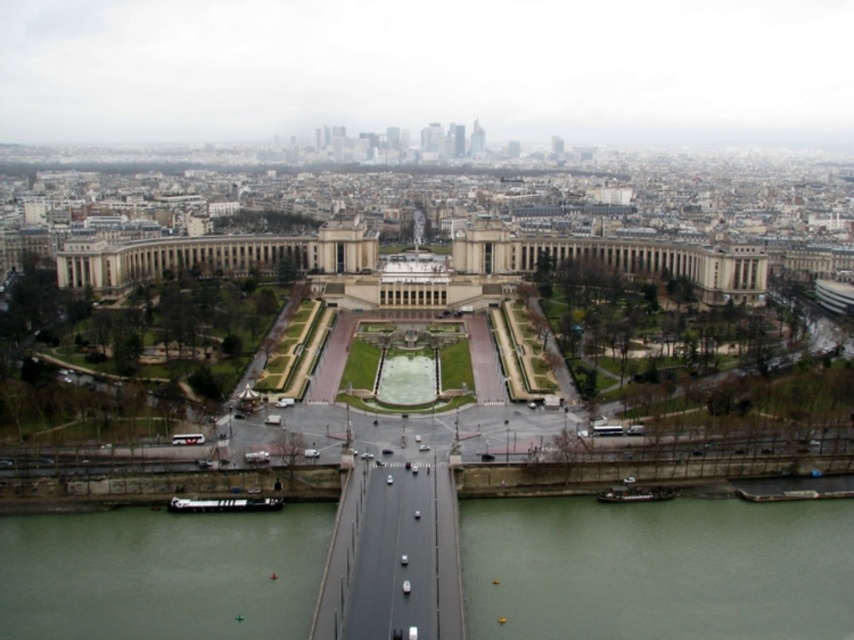
What are the coordinates of `green water at lower right` in the screenshot? It's located at (656, 568).

Between green water at lower right and clear glass waterway at center, which one appears on the left side from the viewer's perspective?

clear glass waterway at center

What are the coordinates of `green water at lower right` in the screenshot? It's located at (656, 568).

Does green water at lower left have a greater width compared to clear glass waterway at center?

Yes, green water at lower left is wider than clear glass waterway at center.

Is point (0, 588) behind point (427, 356)?

No, it is in front of (427, 356).

In order to click on green water at lower left in this screenshot , I will do click(162, 573).

Describe the element at coordinates (656, 568) in the screenshot. I see `green water at lower right` at that location.

Based on the photo, between green water at lower right and green water at lower left, which one is positioned lower?

green water at lower right is lower down.

Which is behind, point (635, 513) or point (132, 589)?

The point (635, 513) is more distant.

This screenshot has height=640, width=854. I want to click on green water at lower right, so click(656, 568).